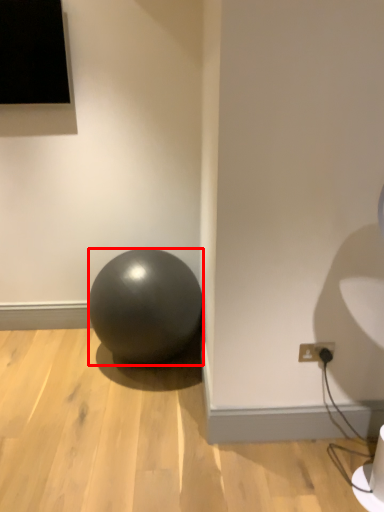
Question: From the image's perspective, where is ball (annotated by the red box) located relative to electric outlet?

Choices:
 (A) below
 (B) above

Answer: (B)